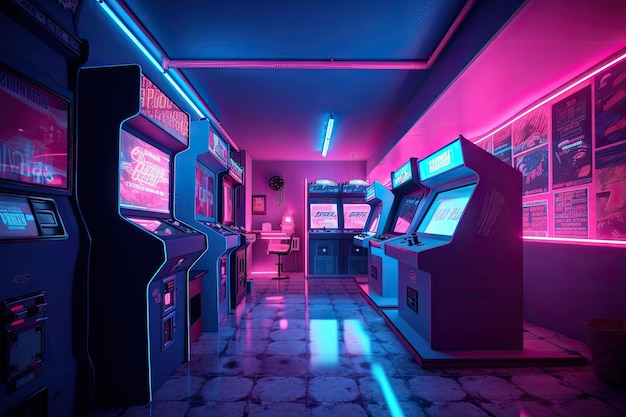
I want to click on pink wall, so click(484, 100), click(302, 169).